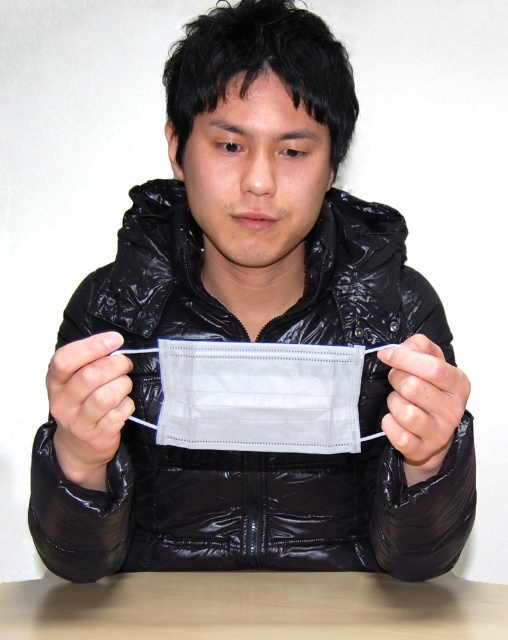
Which is more to the left, light brown wooden table at lower center or white matte fabric mask at center?

From the viewer's perspective, white matte fabric mask at center appears more on the left side.

Between light brown wooden table at lower center and white matte fabric mask at center, which one has more height?

Standing taller between the two is white matte fabric mask at center.

What do you see at coordinates (252, 608) in the screenshot?
I see `light brown wooden table at lower center` at bounding box center [252, 608].

Identify the location of light brown wooden table at lower center. The width and height of the screenshot is (508, 640). (252, 608).

In the scene shown: Does light brown wooden table at lower center have a lesser width compared to white matte mask at center?

No, light brown wooden table at lower center is not thinner than white matte mask at center.

Does light brown wooden table at lower center appear on the left side of white matte mask at center?

Correct, you'll find light brown wooden table at lower center to the left of white matte mask at center.

The width and height of the screenshot is (508, 640). Identify the location of light brown wooden table at lower center. (252, 608).

Can you confirm if black shiny jacket at center is shorter than white matte fabric mask at center?

No, black shiny jacket at center is not shorter than white matte fabric mask at center.

The width and height of the screenshot is (508, 640). Describe the element at coordinates (251, 509) in the screenshot. I see `black shiny jacket at center` at that location.

Between point (447, 536) and point (84, 412), which one is positioned in front?

Point (84, 412) is more forward.

Identify the location of black shiny jacket at center. (251, 509).